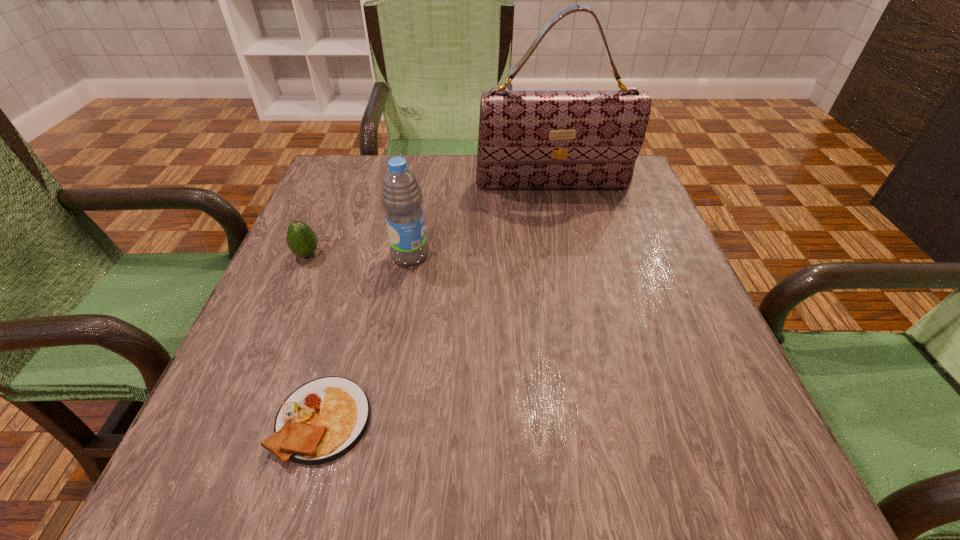
In the image, there is a desktop. Where is `vacant space at the left edge`? The height and width of the screenshot is (540, 960). vacant space at the left edge is located at coordinates (258, 339).

Find the location of a particular element. vacant space at the right edge is located at coordinates coord(682,334).

Locate an element on the screen. vacant area at the far left corner of the desktop is located at coordinates (352, 176).

Find the location of a particular element. free space at the near left corner of the desktop is located at coordinates (185, 493).

The image size is (960, 540). What are the coordinates of `vacant space at the near right corner` in the screenshot? It's located at (755, 476).

This screenshot has height=540, width=960. Find the location of `vacant area that lies between the shortest object and the handbag`. vacant area that lies between the shortest object and the handbag is located at coordinates (438, 302).

Where is `vacant area that lies between the rightmost object and the avocado`? The height and width of the screenshot is (540, 960). vacant area that lies between the rightmost object and the avocado is located at coordinates (430, 220).

I want to click on vacant region between the water bottle and the avocado, so click(x=358, y=255).

Locate an element on the screen. The image size is (960, 540). vacant area that lies between the water bottle and the shortest object is located at coordinates [367, 338].

Where is `vacant space in between the nearest object and the second tallest object`? This screenshot has width=960, height=540. vacant space in between the nearest object and the second tallest object is located at coordinates (367, 338).